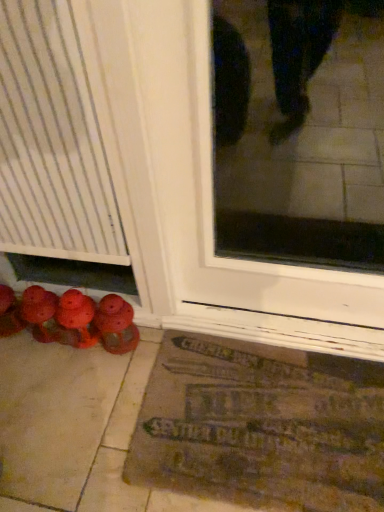
Question: Is brown textured mat at lower center taller or shorter than matte red shoes at lower left, which appears as the 1th footwear when viewed from the left?

Choices:
 (A) short
 (B) tall

Answer: (A)

Question: Is point (170, 461) positioned closer to the camera than point (0, 292)?

Choices:
 (A) closer
 (B) farther

Answer: (A)

Question: Estimate the real-world distances between objects in this image. Which object is closer to the brown textured mat at lower center?

Choices:
 (A) matte red shoes at lower left, positioned as the first footwear in right-to-left order
 (B) matte red shoes at lower left, which is counted as the second footwear, starting from the right

Answer: (A)

Question: Which is nearer to the matte red shoes at lower left, which appears as the 1th footwear when viewed from the left?

Choices:
 (A) brown textured mat at lower center
 (B) matte red shoes at lower left, positioned as the 2th footwear in left-to-right order

Answer: (B)